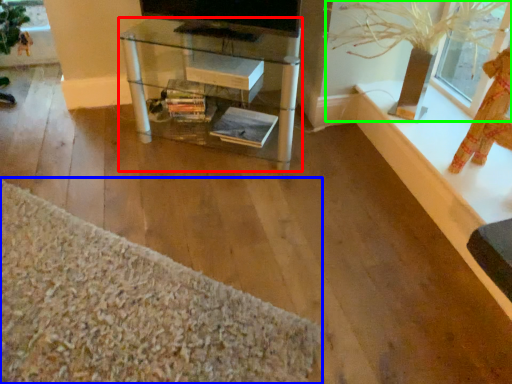
Question: Which is farther away from table (highlighted by a red box)? plain (highlighted by a blue box) or plant (highlighted by a green box)?

Choices:
 (A) plain
 (B) plant

Answer: (A)